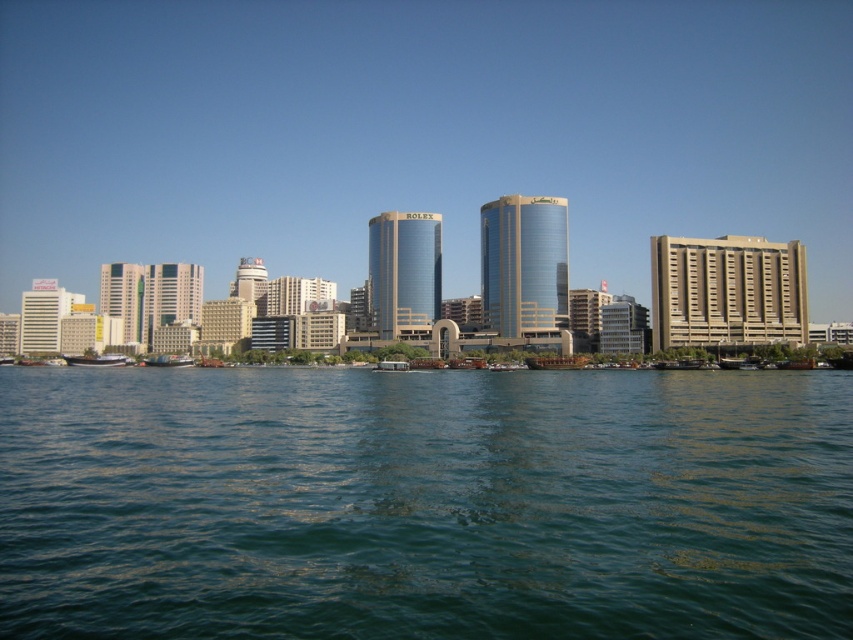
Does greenish-blue water at center have a lesser width compared to metallic silver boat at center?

No, greenish-blue water at center is not thinner than metallic silver boat at center.

I want to click on greenish-blue water at center, so click(424, 502).

Where is `greenish-blue water at center`? The height and width of the screenshot is (640, 853). greenish-blue water at center is located at coordinates (424, 502).

Can you confirm if white glossy boat at lower left is positioned to the left of wooden planks boat at center?

Indeed, white glossy boat at lower left is positioned on the left side of wooden planks boat at center.

Is white glossy boat at lower left in front of wooden planks boat at center?

No.

Where is `white glossy boat at lower left`? white glossy boat at lower left is located at coordinates (96, 358).

The width and height of the screenshot is (853, 640). I want to click on white glossy boat at lower left, so click(96, 358).

Which is more to the right, green plastic boat at lower left or wooden planks boat at center?

From the viewer's perspective, wooden planks boat at center appears more on the right side.

Is green plastic boat at lower left further to camera compared to wooden planks boat at center?

Yes, it is behind wooden planks boat at center.

This screenshot has height=640, width=853. Identify the location of green plastic boat at lower left. (169, 358).